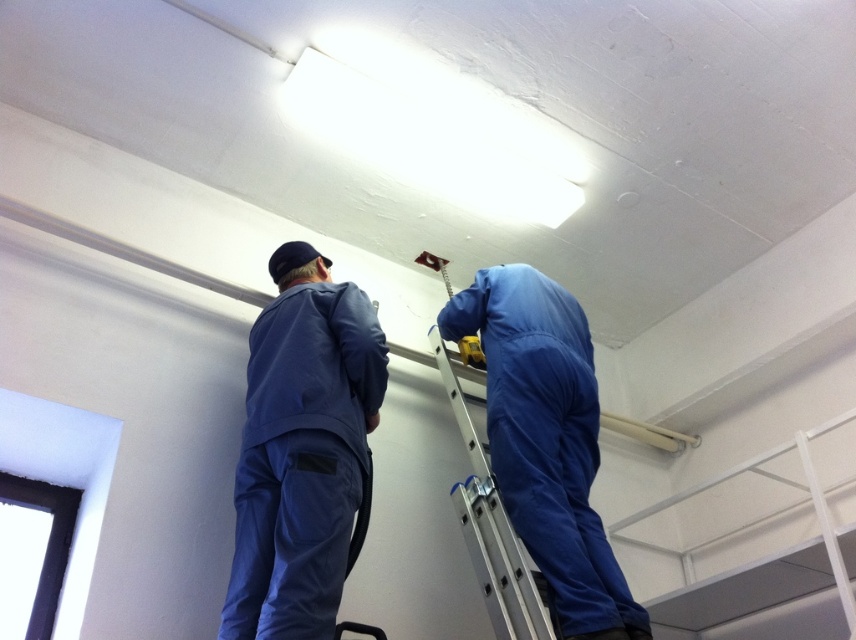
Question: Does blue fabric jumpsuit at center lie in front of silver metallic ladder at upper center?

Choices:
 (A) no
 (B) yes

Answer: (B)

Question: Which of these objects is positioned farthest from the blue fabric jumpsuit at center?

Choices:
 (A) silver metallic ladder at upper center
 (B) blue matte jumpsuit at upper center

Answer: (B)

Question: Which point appears closest to the camera in this image?

Choices:
 (A) (337, 422)
 (B) (589, 372)
 (C) (488, 557)

Answer: (A)

Question: Which point is farther to the camera?

Choices:
 (A) (548, 582)
 (B) (458, 515)
 (C) (367, 365)

Answer: (B)

Question: From the image, what is the correct spatial relationship of blue matte jumpsuit at upper center in relation to silver metallic ladder at upper center?

Choices:
 (A) above
 (B) below

Answer: (A)

Question: Does blue matte jumpsuit at upper center come in front of silver metallic ladder at upper center?

Choices:
 (A) no
 (B) yes

Answer: (B)